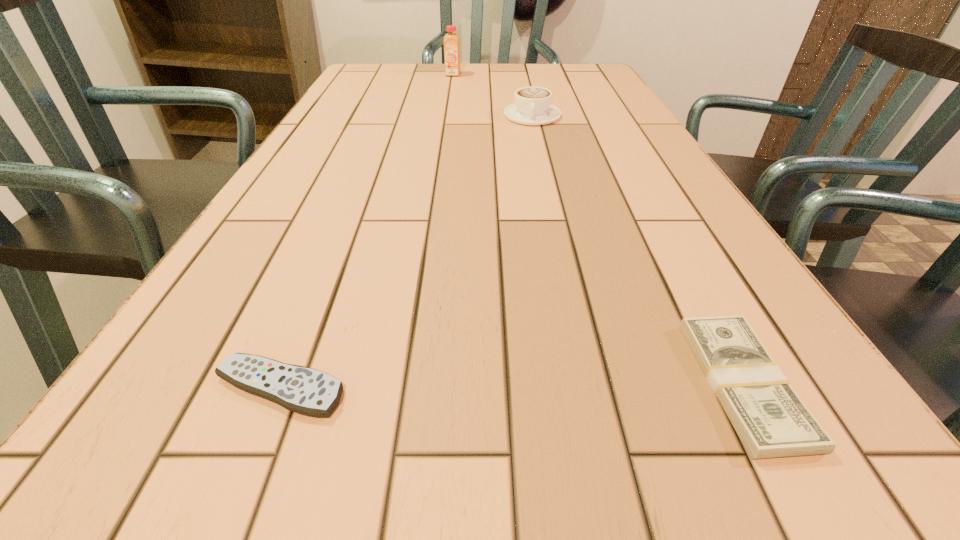
Where is `empty location between the leftmost object and the rightmost object`? empty location between the leftmost object and the rightmost object is located at coordinates (512, 386).

This screenshot has height=540, width=960. What are the coordinates of `free spot between the rightmost object and the second object from left to right` in the screenshot? It's located at (598, 230).

Find the location of `unoccupied area between the orange juice and the second tallest object`. unoccupied area between the orange juice and the second tallest object is located at coordinates (492, 95).

Where is `empty space between the tallest object and the remote control`? Image resolution: width=960 pixels, height=540 pixels. empty space between the tallest object and the remote control is located at coordinates (366, 231).

Locate an element on the screen. The height and width of the screenshot is (540, 960). free space between the remote control and the third shortest object is located at coordinates (406, 252).

Find the location of a particular element. vacant space that is in between the farthest object and the second tallest object is located at coordinates (492, 95).

Image resolution: width=960 pixels, height=540 pixels. Find the location of `free point between the remote control and the dollar`. free point between the remote control and the dollar is located at coordinates (512, 386).

Where is `vacant area between the second object from right to left and the rightmost object`? vacant area between the second object from right to left and the rightmost object is located at coordinates (637, 250).

I want to click on empty space between the rightmost object and the remote control, so click(x=512, y=386).

Identify the location of the second closest object to the cappuccino. The height and width of the screenshot is (540, 960). (771, 420).